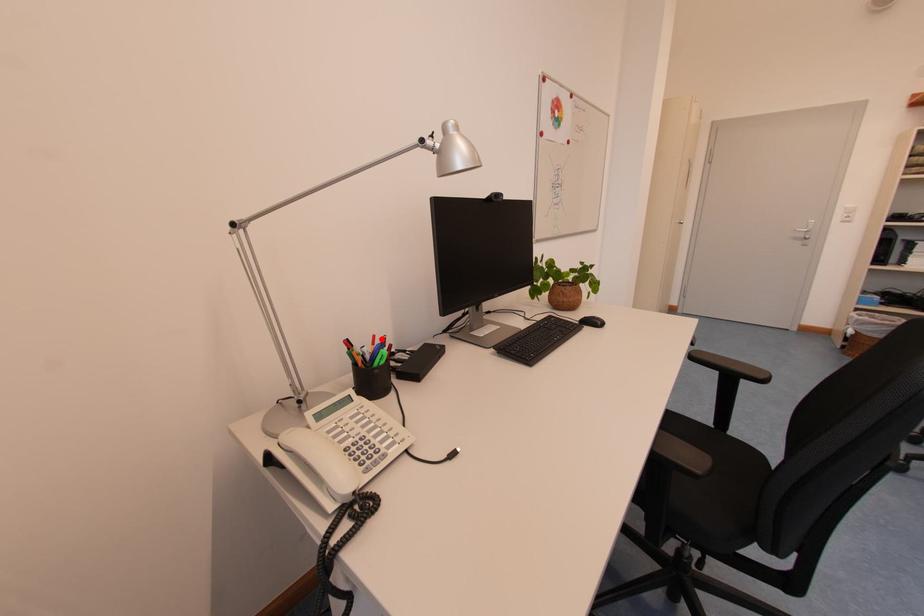
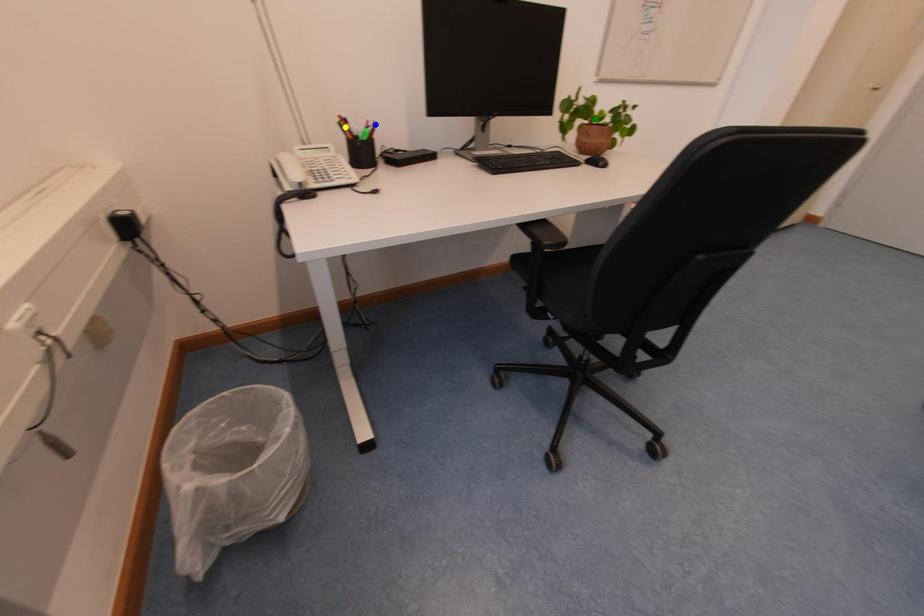
Question: I am providing you with two images of the same scene from different viewpoints. A red point is marked on the first image. You are given multiple points on the second image. Which mark in image 2 goes with the point in image 1?

Choices:
 (A) yellow point
 (B) green point
 (C) blue point

Answer: (C)